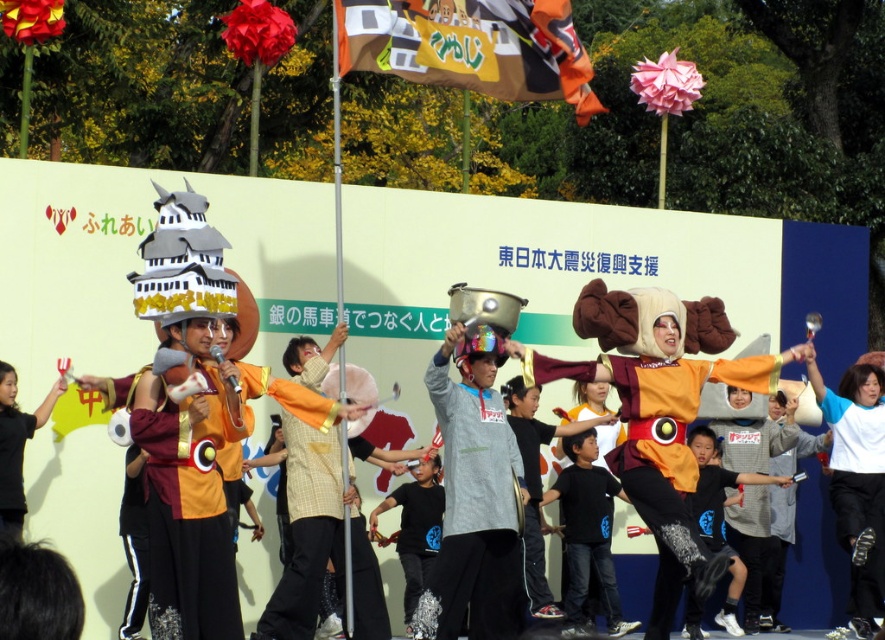
What is located at the point with coordinates (470, 45)?

The point at (470, 45) is where the cardboard banner at upper center is located.

You are a photographer at the event and want to capture the cardboard banner at upper center in your shot. Which direction should you move to ensure it appears in the center of your camera frame?

The cardboard banner at upper center is located at point (470,45), so moving slightly to the right would center it in your camera frame.